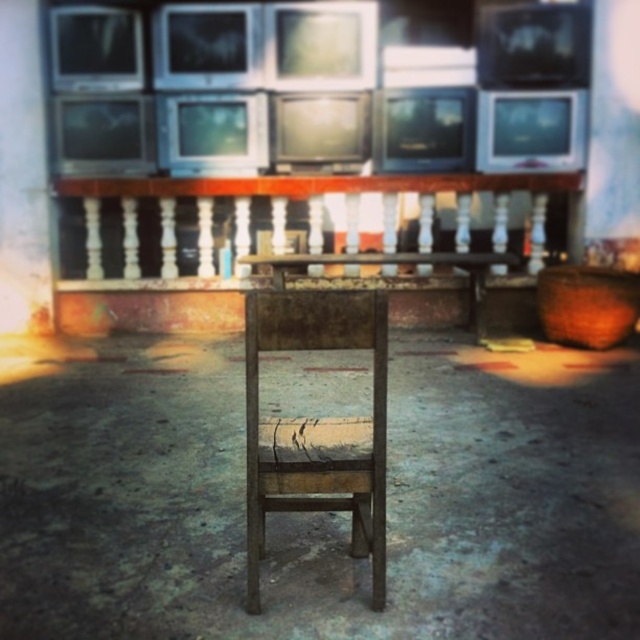
Which is behind, point (355, 186) or point (316, 433)?

Point (355, 186)

This screenshot has height=640, width=640. I want to click on white wooden balustrade at center, so click(301, 220).